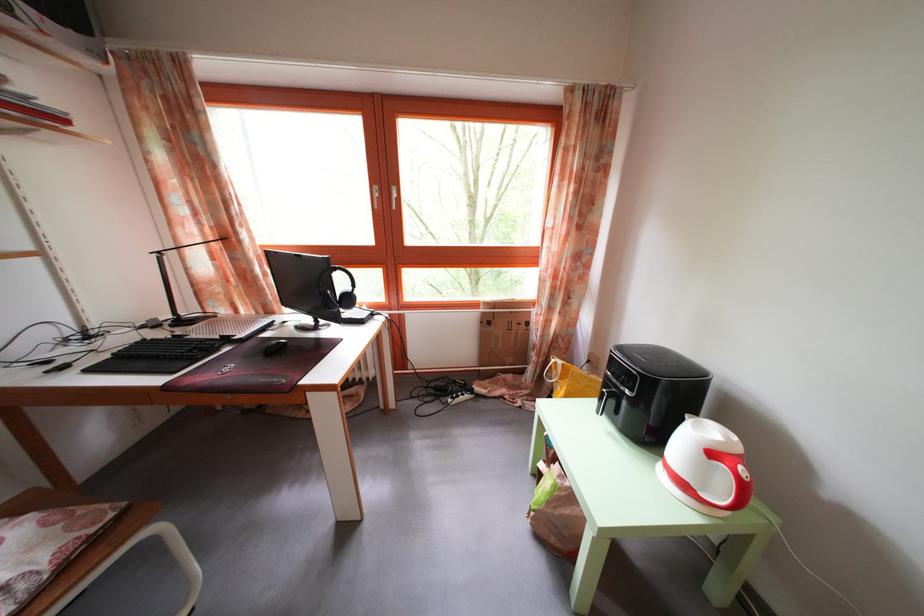
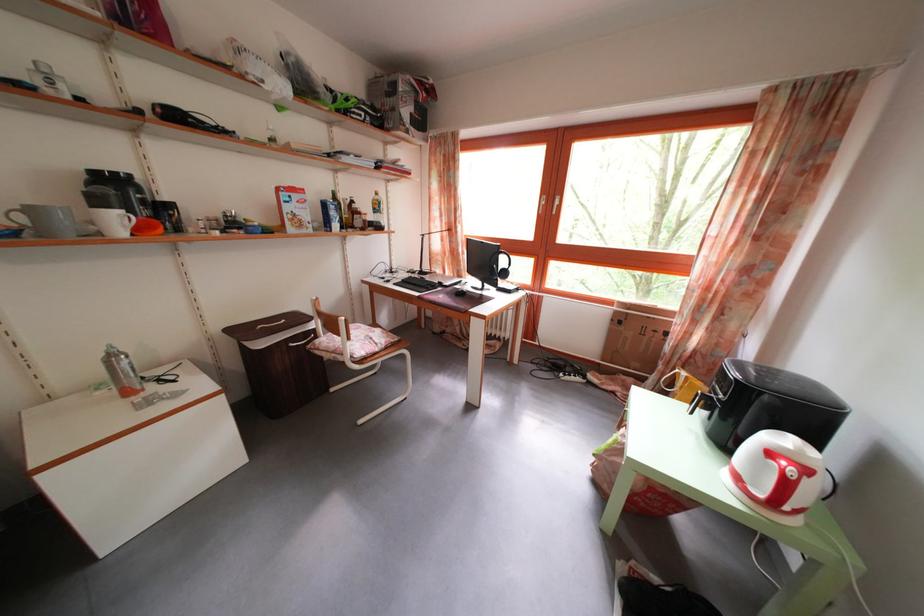
Locate, in the second image, the point that corresponds to the point at 567,369 in the first image.

(691, 381)